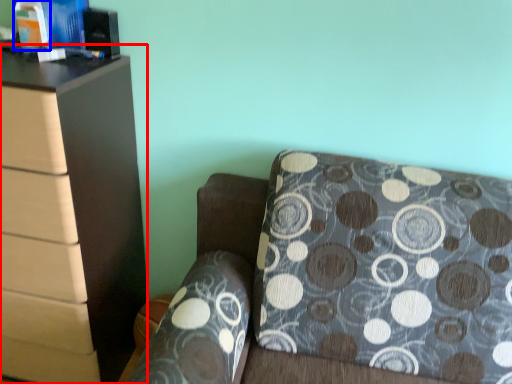
Question: Among these objects, which one is nearest to the camera, chest of drawers (highlighted by a red box) or book (highlighted by a blue box)?

Choices:
 (A) chest of drawers
 (B) book

Answer: (A)